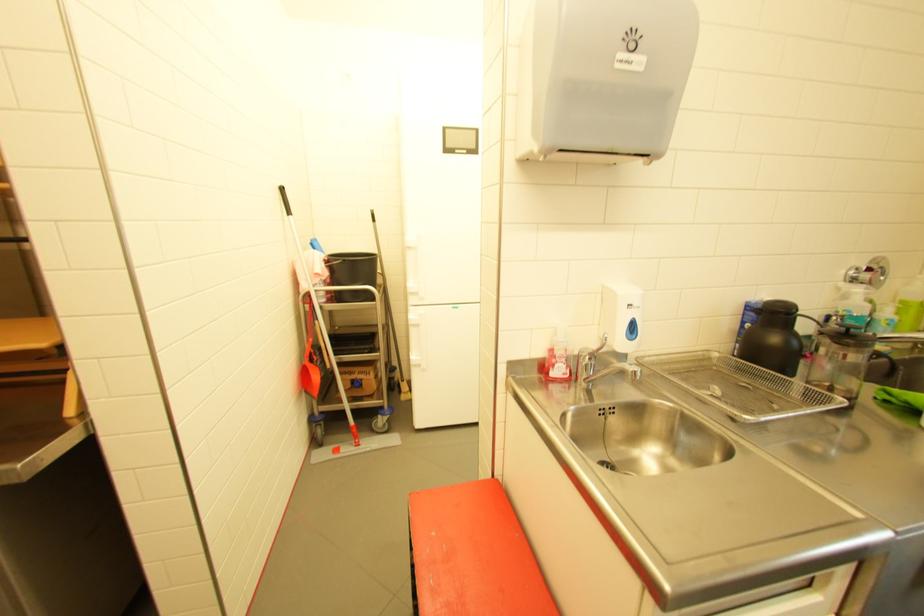
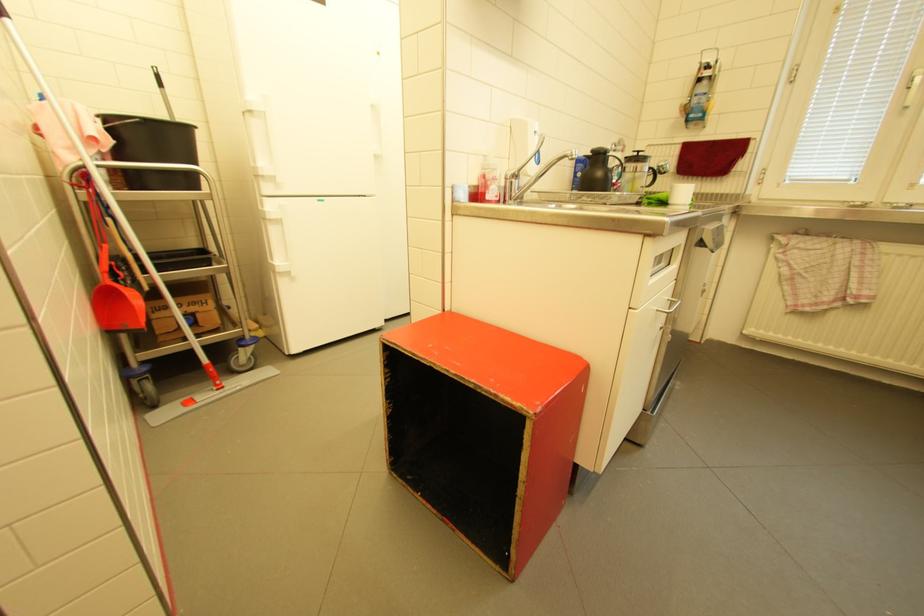
Question: The images are taken continuously from a first-person perspective. In which direction is your viewpoint rotating?

Choices:
 (A) Left
 (B) Right
 (C) Up
 (D) Down

Answer: (B)